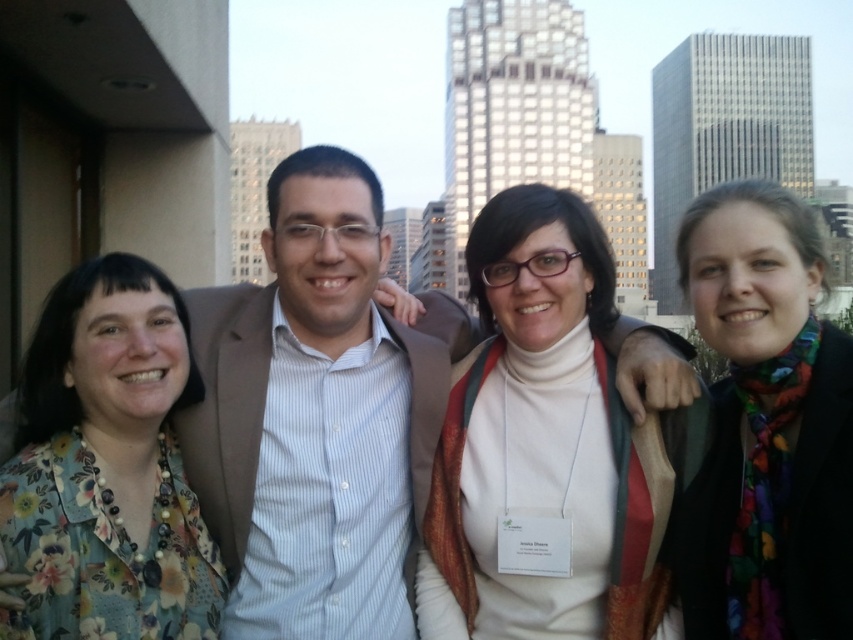
Question: Which object is closer to the camera taking this photo?

Choices:
 (A) floral print blouse at left
 (B) multicolored scarf at right
 (C) white turtleneck sweater at center
 (D) matte brown suit at center

Answer: (A)

Question: In this image, where is matte brown suit at center located relative to multicolored scarf at right?

Choices:
 (A) right
 (B) left

Answer: (B)

Question: Considering the relative positions of white turtleneck sweater at center and floral print blouse at left in the image provided, where is white turtleneck sweater at center located with respect to floral print blouse at left?

Choices:
 (A) right
 (B) left

Answer: (A)

Question: Does matte brown suit at center have a larger size compared to floral print blouse at left?

Choices:
 (A) yes
 (B) no

Answer: (A)

Question: Which is nearer to the white turtleneck sweater at center?

Choices:
 (A) multicolored scarf at right
 (B) floral print blouse at left
 (C) matte brown suit at center

Answer: (C)

Question: Which point is closer to the camera?

Choices:
 (A) white turtleneck sweater at center
 (B) matte brown suit at center
 (C) multicolored scarf at right
 (D) floral print blouse at left

Answer: (D)